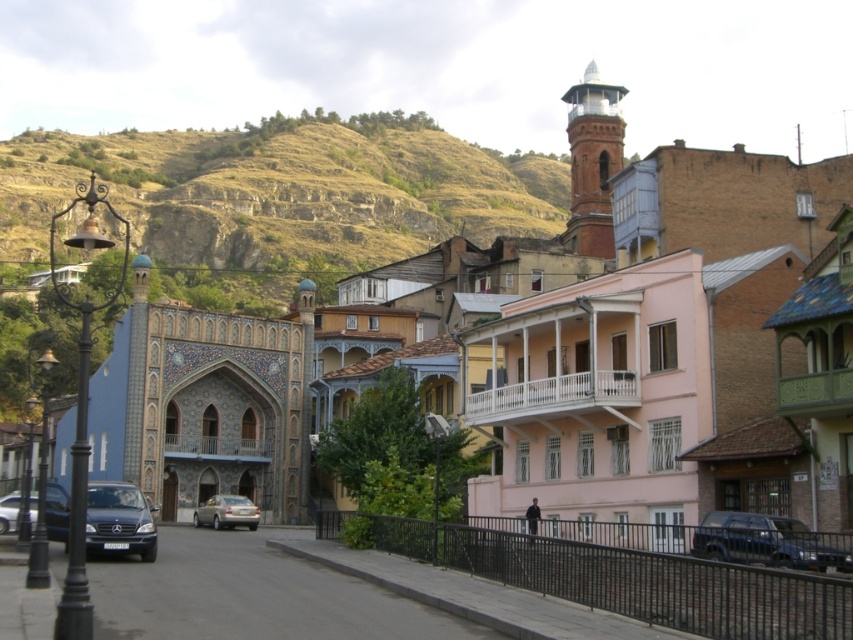
What are the coordinates of the rustic stone hillside at upper left?

The rustic stone hillside at upper left is located at coordinates point [280,196].

You are a photographer planning to take a picture of the shiny black car at center and the rustic stone hillside at upper left. Which object should you focus on first if you want to capture both in a single frame without moving the camera?

The rustic stone hillside at upper left should be focused on first because it is taller than the shiny black car at center, allowing the photographer to adjust the camera settings for the height difference while keeping both in frame.

You are a delivery driver who needs to park your metallic gray sedan at lower right near the rustic stone hillside at upper left. Based on the scene, can you estimate if there is enough space between them for your vehicle to maneuver?

The rustic stone hillside at upper left is positioned on the left side of metallic gray sedan at lower right, so there is space between them for the metallic gray sedan at lower right to maneuver.